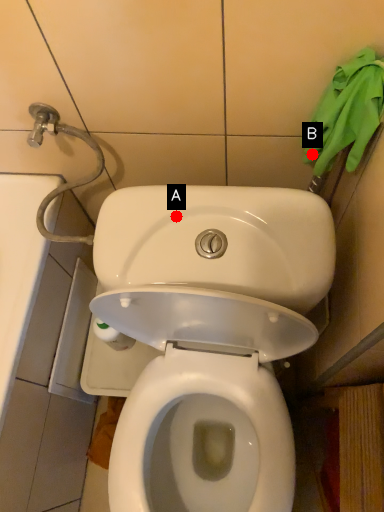
Question: Two points are circled on the image, labeled by A and B beside each circle. Which point appears farthest from the camera in this image?

Choices:
 (A) A is further
 (B) B is further

Answer: (B)